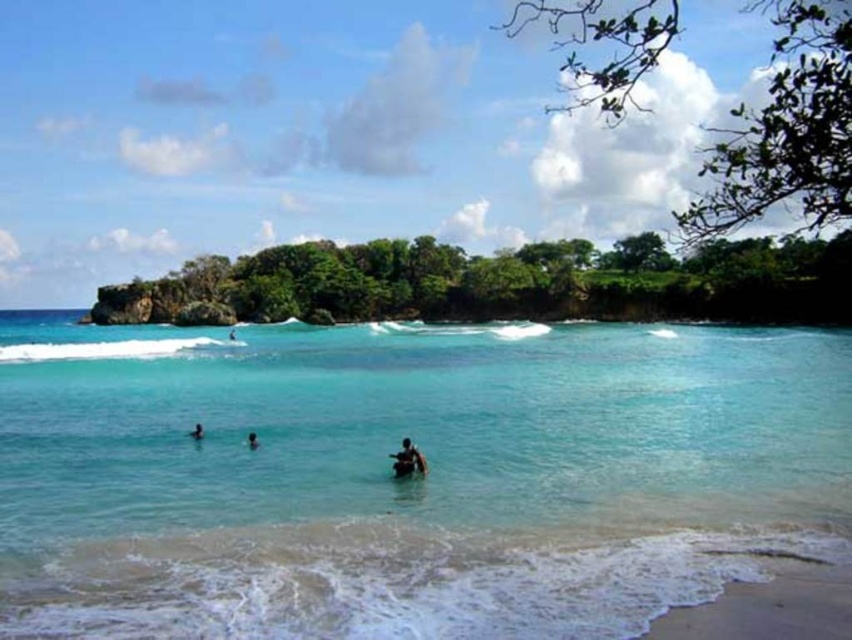
Is dark brown skin at lower center smaller than dark blue skin at center?

Yes, dark brown skin at lower center is smaller than dark blue skin at center.

Can you confirm if dark brown skin at lower center is bigger than dark blue skin at center?

No, dark brown skin at lower center is not bigger than dark blue skin at center.

Is point (202, 428) positioned after point (232, 339)?

No, (202, 428) is closer to viewer.

Locate an element on the screen. This screenshot has width=852, height=640. dark brown skin at lower center is located at coordinates (196, 432).

Does clear blue water at center have a lesser width compared to dark blue skin at center?

No.

Can you confirm if clear blue water at center is bigger than dark blue skin at center?

Indeed, clear blue water at center has a larger size compared to dark blue skin at center.

The width and height of the screenshot is (852, 640). Identify the location of clear blue water at center. (407, 480).

Image resolution: width=852 pixels, height=640 pixels. I want to click on clear blue water at center, so click(x=407, y=480).

Who is higher up, clear blue water at center or smooth skin person at lower center?

clear blue water at center

Is clear blue water at center positioned at the back of smooth skin person at lower center?

No.

The width and height of the screenshot is (852, 640). Describe the element at coordinates (407, 480) in the screenshot. I see `clear blue water at center` at that location.

Find the location of `clear blue water at center`. clear blue water at center is located at coordinates (407, 480).